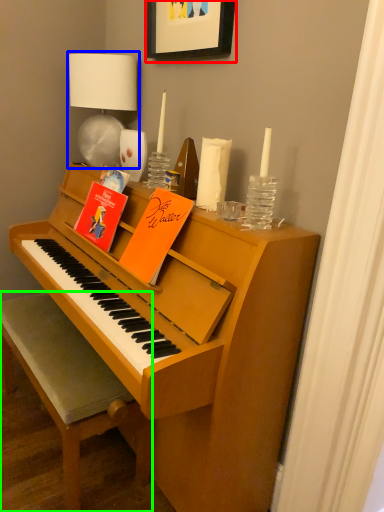
Question: Estimate the real-world distances between objects in this image. Which object is farther from picture frame (highlighted by a red box), table lamp (highlighted by a blue box) or chair (highlighted by a green box)?

Choices:
 (A) table lamp
 (B) chair

Answer: (B)